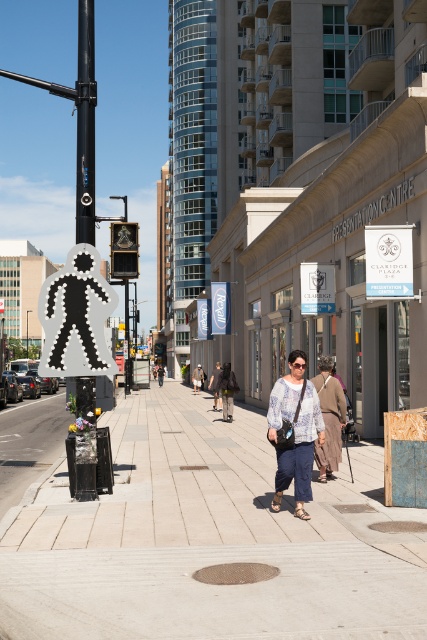
Consider the image. Which of these two, gray concrete sidewalk at center or black metal pole at upper center, stands taller?

With more height is black metal pole at upper center.

Can you confirm if gray concrete sidewalk at center is positioned to the left of black metal pole at upper center?

No, gray concrete sidewalk at center is not to the left of black metal pole at upper center.

The width and height of the screenshot is (427, 640). What do you see at coordinates (208, 540) in the screenshot?
I see `gray concrete sidewalk at center` at bounding box center [208, 540].

Locate an element on the screen. gray concrete sidewalk at center is located at coordinates (208, 540).

Is point (275, 394) in front of point (325, 435)?

That is True.

Is matte blue jeans at center closer to the viewer compared to white lace blouse at center?

That is True.

Is point (300, 461) positioned before point (330, 365)?

Yes, point (300, 461) is closer to viewer.

At what (x,y) coordinates should I click in order to perform the action: click on matte blue jeans at center. Please return your answer as a coordinate pair (x, y). Image resolution: width=427 pixels, height=640 pixels. Looking at the image, I should click on click(x=295, y=432).

In the scene shown: Is denim pants at center closer to camera compared to khaki cotton pants at center?

That is True.

Does denim pants at center lie behind khaki cotton pants at center?

No, it is not.

The height and width of the screenshot is (640, 427). Describe the element at coordinates (227, 388) in the screenshot. I see `denim pants at center` at that location.

You are a GUI agent. You are given a task and a screenshot of the screen. Output one action in this format:
    pyautogui.click(x=<x>, y=<y>)
    Task: Click on the denim pants at center
    
    Given the screenshot: What is the action you would take?
    pyautogui.click(x=227, y=388)